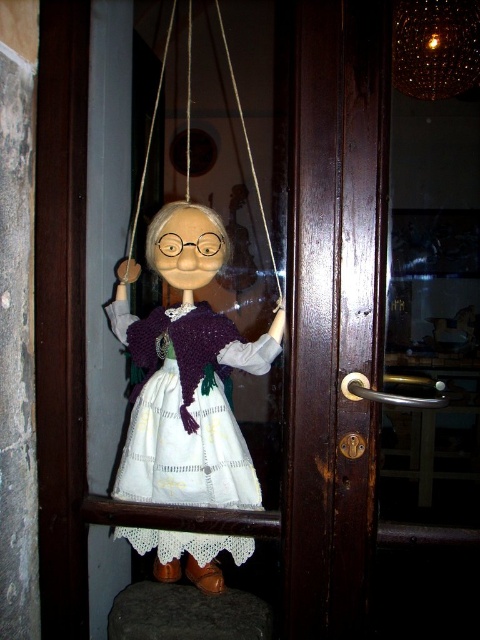
You are standing in front of the wooden door and want to know which of the two points, point (133,342) or point (145,148), is closer to you. Can you determine this based on their positions?

Point (133,342) is closer to the viewer than point (145,148).

You are a small toy bird that is 3 inches wide. You want to fly between the white string at upper center and the silky brown string at upper center. Can you fit through the space between them?

The distance between the white string at upper center and the silky brown string at upper center is 12.10 inches. Since the toy bird is only 3 inches wide, it can easily fit through the space between them.

You are a painter standing 3 feet away from the wooden door. You want to paint the white lace dress at center. Can you reach the dress with your paintbrush?

The white lace dress at center is 36.26 inches from viewer. Since 3 feet equals 36 inches, the dress is slightly further away than your current position. You need to move closer to reach it with your paintbrush.